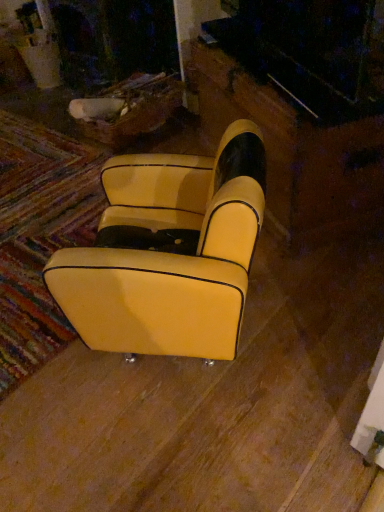
The image size is (384, 512). Identify the location of free space to the right of yellow leather chair at center. (315, 307).